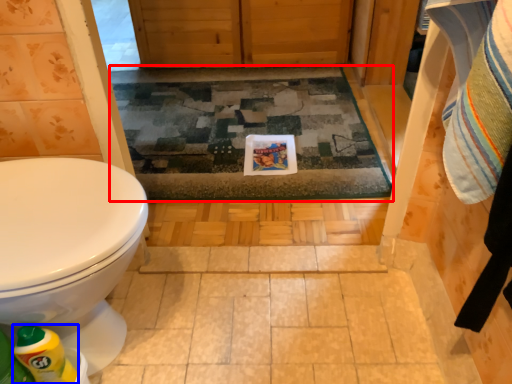
Question: Which object is further to the camera taking this photo, bath mat (highlighted by a red box) or cleaning product (highlighted by a blue box)?

Choices:
 (A) bath mat
 (B) cleaning product

Answer: (A)